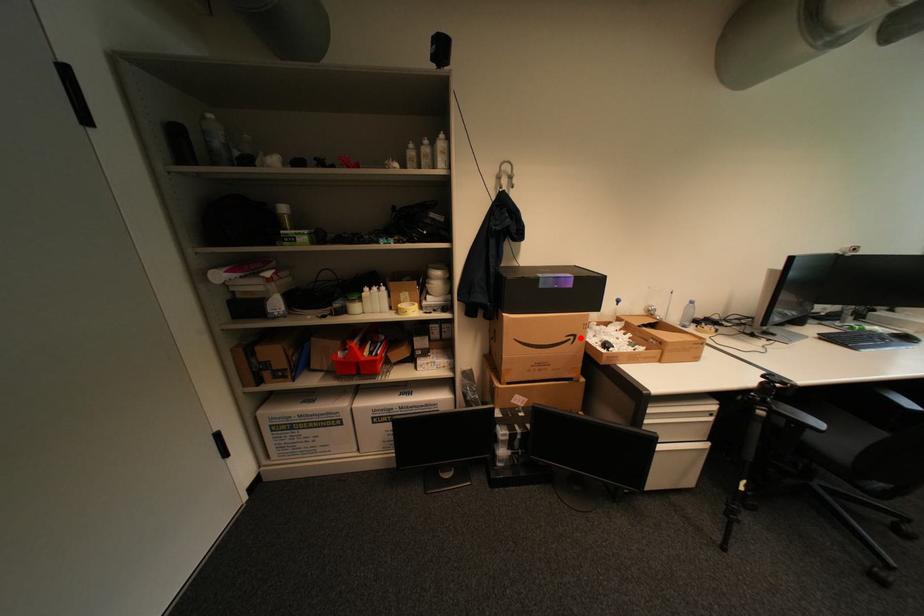
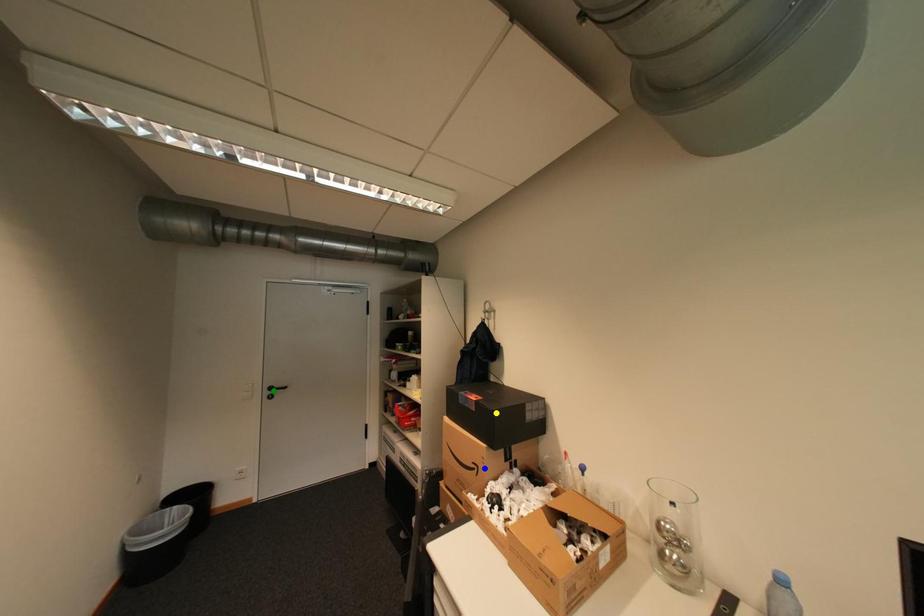
Question: I am providing you with two images of the same scene from different viewpoints. A red point is marked on the first image. You are given multiple points on the second image. Which point in image 2 represents the same 3d spot as the red point in image 1?

Choices:
 (A) green point
 (B) blue point
 (C) yellow point

Answer: (B)